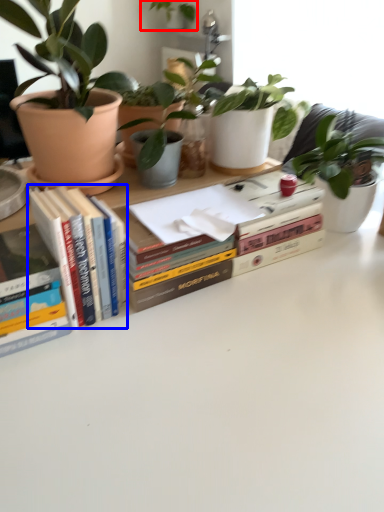
Question: Which object is closer to the camera taking this photo, houseplant (highlighted by a red box) or book (highlighted by a blue box)?

Choices:
 (A) houseplant
 (B) book

Answer: (B)